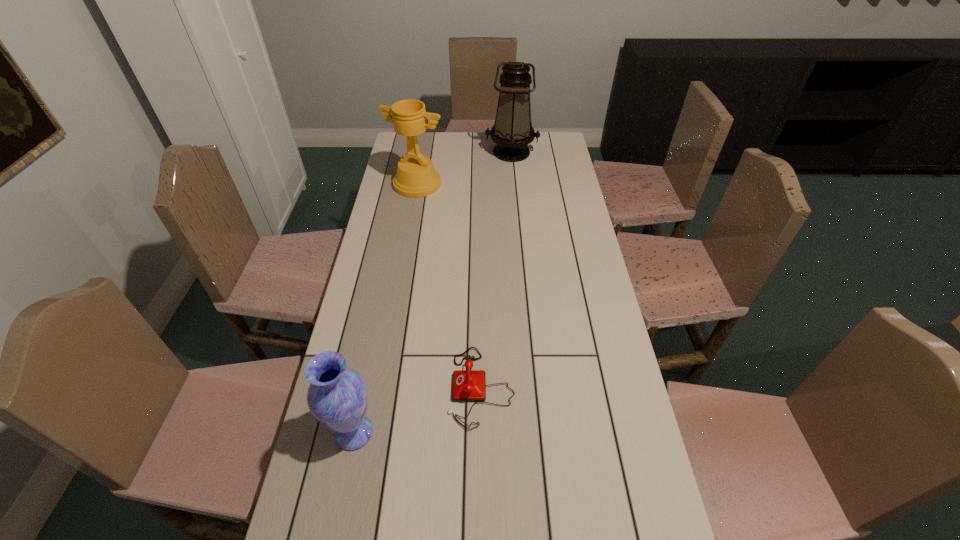
The image size is (960, 540). I want to click on vacant space located 0.130m on the dial of the telephone, so click(x=401, y=387).

In order to click on object present at the far edge in this screenshot , I will do `click(512, 131)`.

Locate an element on the screen. This screenshot has width=960, height=540. award located at the left edge is located at coordinates (416, 177).

At what (x,y) coordinates should I click in order to perform the action: click on vase located at the left edge. Please return your answer as a coordinate pair (x, y). The image size is (960, 540). Looking at the image, I should click on (337, 397).

At what (x,y) coordinates should I click in order to perform the action: click on object positioned at the right edge. Please return your answer as a coordinate pair (x, y). This screenshot has width=960, height=540. Looking at the image, I should click on (512, 131).

Where is `object that is at the far right corner`? The width and height of the screenshot is (960, 540). object that is at the far right corner is located at coordinates (512, 131).

At what (x,y) coordinates should I click in order to perform the action: click on free space at the left edge. Please return your answer as a coordinate pair (x, y). The image size is (960, 540). Looking at the image, I should click on (333, 453).

The width and height of the screenshot is (960, 540). Find the location of `vacant region at the right edge of the desktop`. vacant region at the right edge of the desktop is located at coordinates (587, 440).

The height and width of the screenshot is (540, 960). I want to click on vacant space at the far left corner of the desktop, so click(420, 148).

Where is `vacant area at the far right corner of the desktop`? Image resolution: width=960 pixels, height=540 pixels. vacant area at the far right corner of the desktop is located at coordinates (552, 157).